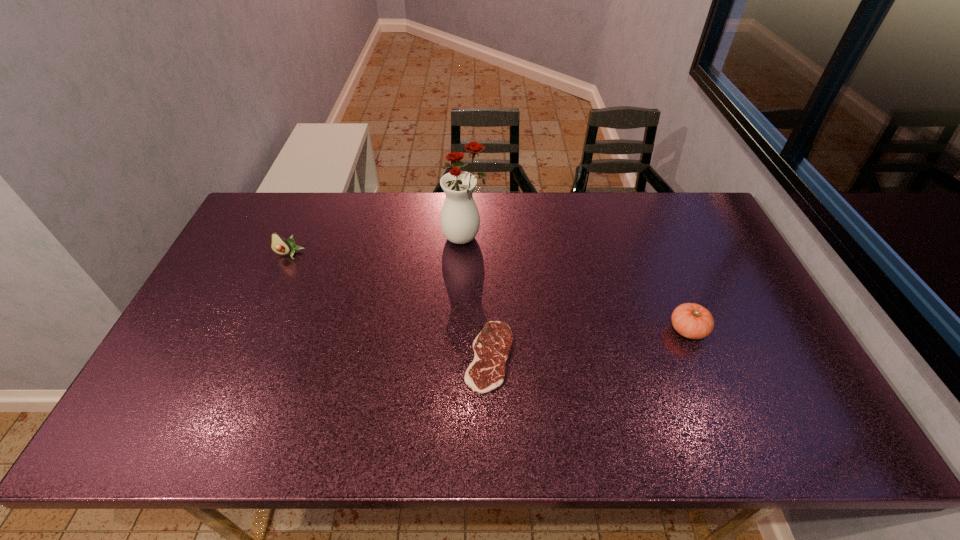
Locate an element on the screen. The width and height of the screenshot is (960, 540). free space that satisfies the following two spatial constraints: 1. on the seed side of the avocado; 2. on the right side of the tomato is located at coordinates (256, 330).

Find the location of `vacant region that satisfies the following two spatial constraints: 1. on the seed side of the tomato; 2. on the left side of the avocado`. vacant region that satisfies the following two spatial constraints: 1. on the seed side of the tomato; 2. on the left side of the avocado is located at coordinates (256, 330).

What are the coordinates of `free space that satisfies the following two spatial constraints: 1. on the back side of the second shortest object; 2. on the right side of the shortest object` in the screenshot? It's located at (489, 330).